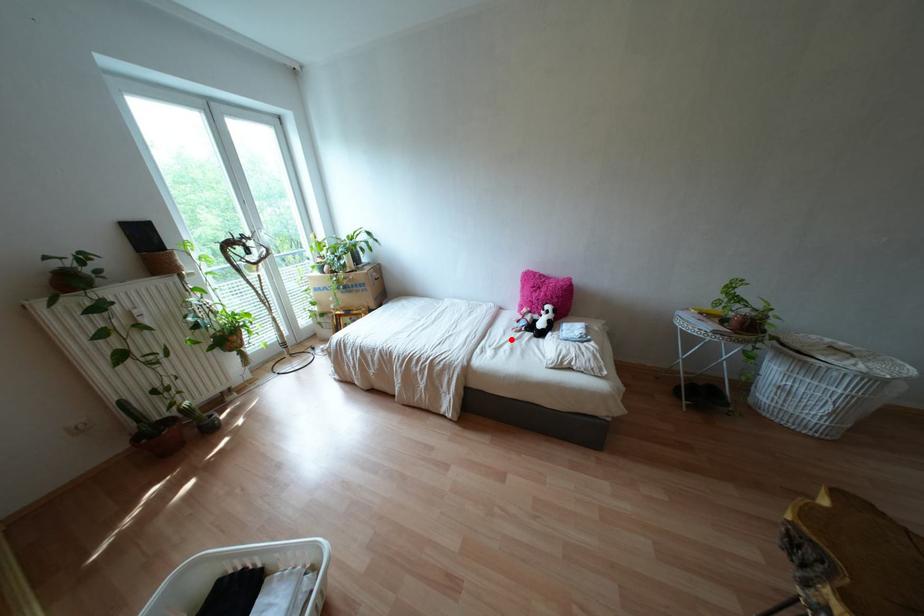
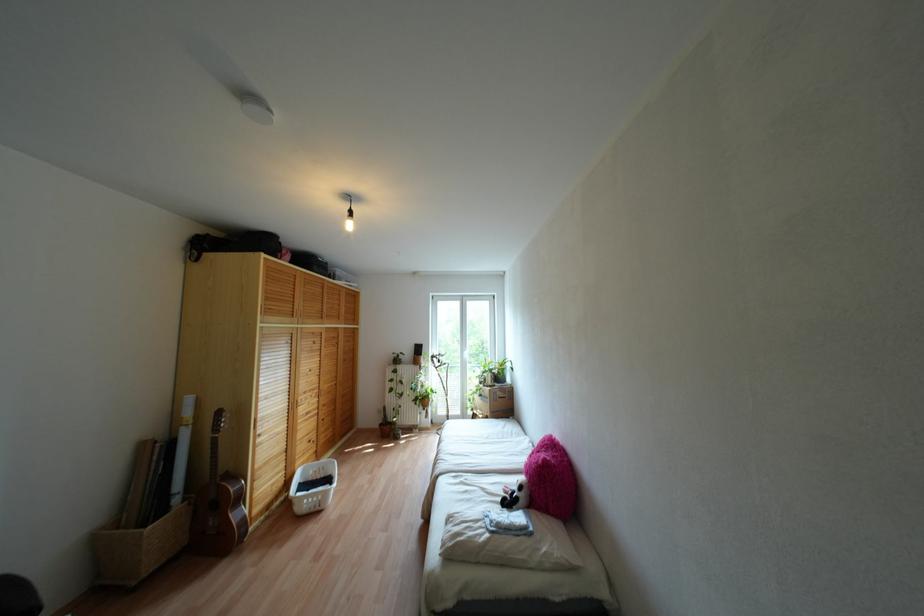
Where in the second image is the point corresponding to the highlighted location from the first image?

(482, 488)